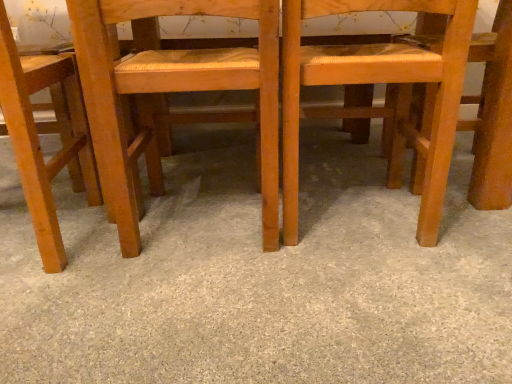
Identify the location of matte wood chair at left, the first chair in the left-to-right sequence. The height and width of the screenshot is (384, 512). (38, 137).

Measure the distance between wooden chair at center, the 2th chair in the left-to-right sequence, and camera.

The distance of wooden chair at center, the 2th chair in the left-to-right sequence, from camera is 30.91 inches.

Measure the distance between wooden chair at center, the 1th chair in the right-to-left sequence, and camera.

The depth of wooden chair at center, the 1th chair in the right-to-left sequence, is 31.65 inches.

The height and width of the screenshot is (384, 512). I want to click on gray carpet at center, so click(x=261, y=280).

Choose the correct answer: Is wooden chair at center, the 1th chair in the right-to-left sequence, inside gray carpet at center or outside it?

wooden chair at center, the 1th chair in the right-to-left sequence, lies outside gray carpet at center.

From the image's perspective, between wooden chair at center, which is counted as the third chair, starting from the left, and gray carpet at center, which one is located above?

From the image's view, wooden chair at center, which is counted as the third chair, starting from the left, is above.

Would you consider wooden chair at center, the 1th chair in the right-to-left sequence, to be distant from gray carpet at center?

No, wooden chair at center, the 1th chair in the right-to-left sequence, is not far away from gray carpet at center.

How much distance is there between wooden chair at center, which is counted as the third chair, starting from the left, and gray carpet at center?

The distance of wooden chair at center, which is counted as the third chair, starting from the left, from gray carpet at center is 13.11 inches.

Is matte wood chair at left, the first chair in the left-to-right sequence, not close to wooden chair at center, the 2th chair when ordered from right to left?

Actually, matte wood chair at left, the first chair in the left-to-right sequence, and wooden chair at center, the 2th chair when ordered from right to left, are a little close together.

Consider the image. Between matte wood chair at left, which is the third chair in right-to-left order, and wooden chair at center, the 2th chair when ordered from right to left, which one appears on the left side from the viewer's perspective?

From the viewer's perspective, matte wood chair at left, which is the third chair in right-to-left order, appears more on the left side.

Do you think matte wood chair at left, the first chair in the left-to-right sequence, is within wooden chair at center, the 2th chair when ordered from right to left, or outside of it?

matte wood chair at left, the first chair in the left-to-right sequence, is not enclosed by wooden chair at center, the 2th chair when ordered from right to left.

Between matte wood chair at left, the first chair in the left-to-right sequence, and wooden chair at center, the 2th chair when ordered from right to left, which one has smaller width?

matte wood chair at left, the first chair in the left-to-right sequence.

Who is bigger, wooden chair at center, the 2th chair in the left-to-right sequence, or gray carpet at center?

Bigger between the two is gray carpet at center.

From the image's perspective, does wooden chair at center, the 2th chair in the left-to-right sequence, appear lower than gray carpet at center?

Actually, wooden chair at center, the 2th chair in the left-to-right sequence, appears above gray carpet at center in the image.

Based on the photo, is wooden chair at center, the 2th chair in the left-to-right sequence, situated inside gray carpet at center or outside?

wooden chair at center, the 2th chair in the left-to-right sequence, is spatially situated outside gray carpet at center.

Does wooden chair at center, the 2th chair in the left-to-right sequence, have a lesser height compared to gray carpet at center?

No, wooden chair at center, the 2th chair in the left-to-right sequence, is not shorter than gray carpet at center.

Which object is positioned more to the left, gray carpet at center or wooden chair at center, the 1th chair in the right-to-left sequence?

gray carpet at center.

Do you think gray carpet at center is within wooden chair at center, which is counted as the third chair, starting from the left, or outside of it?

gray carpet at center cannot be found inside wooden chair at center, which is counted as the third chair, starting from the left.

Consider the image. Is gray carpet at center oriented towards wooden chair at center, which is counted as the third chair, starting from the left?

No, gray carpet at center is not oriented towards wooden chair at center, which is counted as the third chair, starting from the left.

Who is shorter, gray carpet at center or matte wood chair at left, the first chair in the left-to-right sequence?

With less height is gray carpet at center.

Which is behind, point (84, 299) or point (36, 67)?

The point (36, 67) is farther.

From a real-world perspective, which object rests below the other?

In real-world perspective, gray carpet at center is lower.

I want to click on concrete on the right of matte wood chair at left, the first chair in the left-to-right sequence, so click(261, 280).

Which object is positioned more to the left, wooden chair at center, the 1th chair in the right-to-left sequence, or wooden chair at center, the 2th chair in the left-to-right sequence?

From the viewer's perspective, wooden chair at center, the 2th chair in the left-to-right sequence, appears more on the left side.

Consider the image. Is wooden chair at center, the 1th chair in the right-to-left sequence, facing towards wooden chair at center, the 2th chair in the left-to-right sequence?

No, wooden chair at center, the 1th chair in the right-to-left sequence, is not oriented towards wooden chair at center, the 2th chair in the left-to-right sequence.

Can you confirm if wooden chair at center, the 1th chair in the right-to-left sequence, is wider than wooden chair at center, the 2th chair in the left-to-right sequence?

No.

Considering the relative positions of wooden chair at center, the 1th chair in the right-to-left sequence, and matte wood chair at left, which is the third chair in right-to-left order, in the image provided, is wooden chair at center, the 1th chair in the right-to-left sequence, behind matte wood chair at left, which is the third chair in right-to-left order,?

Yes, wooden chair at center, the 1th chair in the right-to-left sequence, is further from the viewer.

In terms of height, does wooden chair at center, the 1th chair in the right-to-left sequence, look taller or shorter compared to matte wood chair at left, which is the third chair in right-to-left order?

wooden chair at center, the 1th chair in the right-to-left sequence, is shorter than matte wood chair at left, which is the third chair in right-to-left order.

Does point (443, 160) appear closer or farther from the camera than point (27, 76)?

Clearly, point (443, 160) is more distant from the camera than point (27, 76).

Locate an element on the screen. This screenshot has width=512, height=384. chair that is the 3rd one when counting upward from the gray carpet at center (from the image's perspective) is located at coordinates (379, 82).

There is a wooden chair at center, the 2th chair when ordered from right to left. Identify the location of chair above it (from a real-world perspective). click(x=38, y=137).

From the image, which object appears to be nearer to gray carpet at center, matte wood chair at left, which is the third chair in right-to-left order, or wooden chair at center, the 1th chair in the right-to-left sequence?

Based on the image, wooden chair at center, the 1th chair in the right-to-left sequence, appears to be nearer to gray carpet at center.

Based on their spatial positions, is wooden chair at center, which is counted as the third chair, starting from the left, or matte wood chair at left, which is the third chair in right-to-left order, further from wooden chair at center, the 2th chair in the left-to-right sequence?

Based on the image, wooden chair at center, which is counted as the third chair, starting from the left, appears to be further to wooden chair at center, the 2th chair in the left-to-right sequence.

Estimate the real-world distances between objects in this image. Which object is further from gray carpet at center, wooden chair at center, the 1th chair in the right-to-left sequence, or wooden chair at center, the 2th chair in the left-to-right sequence?

Among the two, wooden chair at center, the 1th chair in the right-to-left sequence, is located further to gray carpet at center.

Looking at the image, which one is located closer to gray carpet at center, wooden chair at center, the 1th chair in the right-to-left sequence, or matte wood chair at left, which is the third chair in right-to-left order?

Based on the image, wooden chair at center, the 1th chair in the right-to-left sequence, appears to be nearer to gray carpet at center.

Looking at this image, estimate the real-world distances between objects in this image. Which object is further from matte wood chair at left, the first chair in the left-to-right sequence, wooden chair at center, the 2th chair in the left-to-right sequence, or gray carpet at center?

gray carpet at center is further to matte wood chair at left, the first chair in the left-to-right sequence.

Considering their positions, is wooden chair at center, the 2th chair when ordered from right to left, positioned closer to gray carpet at center than wooden chair at center, which is counted as the third chair, starting from the left?

wooden chair at center, the 2th chair when ordered from right to left, is positioned closer to the anchor gray carpet at center.

When comparing their distances from wooden chair at center, the 2th chair when ordered from right to left, does gray carpet at center or matte wood chair at left, the first chair in the left-to-right sequence, seem further?

Result: gray carpet at center lies further to wooden chair at center, the 2th chair when ordered from right to left, than the other object.

Estimate the real-world distances between objects in this image. Which object is closer to wooden chair at center, which is counted as the third chair, starting from the left, matte wood chair at left, which is the third chair in right-to-left order, or wooden chair at center, the 2th chair in the left-to-right sequence?

wooden chair at center, the 2th chair in the left-to-right sequence, is closer to wooden chair at center, which is counted as the third chair, starting from the left.

Where is `chair between matte wood chair at left, which is the third chair in right-to-left order, and gray carpet at center from left to right`? Image resolution: width=512 pixels, height=384 pixels. chair between matte wood chair at left, which is the third chair in right-to-left order, and gray carpet at center from left to right is located at coordinates (172, 91).

This screenshot has height=384, width=512. I want to click on chair between matte wood chair at left, the first chair in the left-to-right sequence, and wooden chair at center, the 1th chair in the right-to-left sequence, in the horizontal direction, so click(172, 91).

Find the location of a particular element. The width and height of the screenshot is (512, 384). concrete between wooden chair at center, the 2th chair when ordered from right to left, and wooden chair at center, which is counted as the third chair, starting from the left, in the horizontal direction is located at coordinates (261, 280).

Where is `concrete located between matte wood chair at left, the first chair in the left-to-right sequence, and wooden chair at center, the 1th chair in the right-to-left sequence, in the left-right direction`? concrete located between matte wood chair at left, the first chair in the left-to-right sequence, and wooden chair at center, the 1th chair in the right-to-left sequence, in the left-right direction is located at coordinates (261, 280).